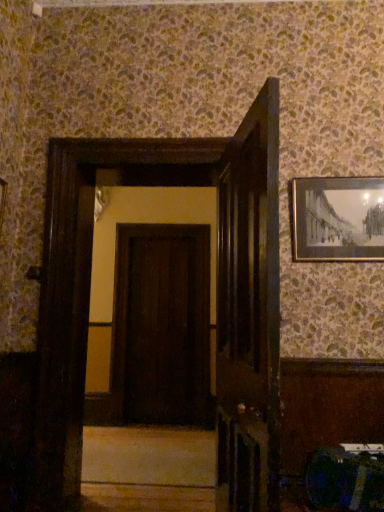
Where is `dark brown wood door at center, marked as the second door in a right-to-left arrangement`? This screenshot has width=384, height=512. dark brown wood door at center, marked as the second door in a right-to-left arrangement is located at coordinates (161, 326).

What is the approximate width of dark wood door at center, marked as the second door in a back-to-front arrangement?

dark wood door at center, marked as the second door in a back-to-front arrangement, is 22.29 centimeters in width.

Describe the element at coordinates (338, 219) in the screenshot. I see `gold-framed picture at upper right` at that location.

Image resolution: width=384 pixels, height=512 pixels. I want to click on smooth beige stair at center, so [149, 456].

Considering the relative sizes of smooth beige stair at center and dark brown wood door at center, marked as the second door in a right-to-left arrangement, in the image provided, is smooth beige stair at center wider than dark brown wood door at center, marked as the second door in a right-to-left arrangement,?

Indeed, smooth beige stair at center has a greater width compared to dark brown wood door at center, marked as the second door in a right-to-left arrangement.

Considering the relative sizes of smooth beige stair at center and dark brown wood door at center, placed as the 1th door when sorted from left to right, in the image provided, is smooth beige stair at center shorter than dark brown wood door at center, placed as the 1th door when sorted from left to right,?

Correct, smooth beige stair at center is not as tall as dark brown wood door at center, placed as the 1th door when sorted from left to right.

Could you measure the distance between smooth beige stair at center and dark brown wood door at center, positioned as the second door in front-to-back order?

smooth beige stair at center and dark brown wood door at center, positioned as the second door in front-to-back order, are 1.25 meters apart from each other.

From the picture: From a real-world perspective, is smooth beige stair at center above or below dark brown wood door at center, marked as the second door in a right-to-left arrangement?

From a real-world perspective, smooth beige stair at center is physically below dark brown wood door at center, marked as the second door in a right-to-left arrangement.

Is dark brown wood door at center, placed as the 1th door when sorted from left to right, turned away from dark wood door at center, marked as the second door in a back-to-front arrangement?

dark brown wood door at center, placed as the 1th door when sorted from left to right, is not turned away from dark wood door at center, marked as the second door in a back-to-front arrangement.

Is dark brown wood door at center, acting as the first door starting from the back, directly adjacent to dark wood door at center, arranged as the first door when viewed from the front?

They are not placed beside each other.

Considering the positions of objects dark brown wood door at center, positioned as the second door in front-to-back order, and dark wood door at center, marked as the second door in a back-to-front arrangement, in the image provided, who is more to the left, dark brown wood door at center, positioned as the second door in front-to-back order, or dark wood door at center, marked as the second door in a back-to-front arrangement,?

From the viewer's perspective, dark brown wood door at center, positioned as the second door in front-to-back order, appears more on the left side.

From the image's perspective, between dark wood door at center, which is the first door from right to left, and smooth beige stair at center, which one is located above?

From the image's view, dark wood door at center, which is the first door from right to left, is above.

Is dark wood door at center, which is the first door from right to left, smaller than smooth beige stair at center?

Incorrect, dark wood door at center, which is the first door from right to left, is not smaller in size than smooth beige stair at center.

Is dark wood door at center, which is the first door from right to left, not close to smooth beige stair at center?

Absolutely, dark wood door at center, which is the first door from right to left, is distant from smooth beige stair at center.

Which object is more forward, dark wood door at center, which is the first door from right to left, or smooth beige stair at center?

dark wood door at center, which is the first door from right to left.

This screenshot has width=384, height=512. In order to click on door that is the 1st one when counting leftward from the gold-framed picture at upper right in this screenshot , I will do `click(249, 312)`.

Which is more to the left, gold-framed picture at upper right or dark wood door at center, arranged as the first door when viewed from the front?

Positioned to the left is dark wood door at center, arranged as the first door when viewed from the front.

Based on the photo, is gold-framed picture at upper right oriented away from dark wood door at center, the second door in the left-to-right sequence?

No, dark wood door at center, the second door in the left-to-right sequence, is not at the back of gold-framed picture at upper right.

In terms of width, does gold-framed picture at upper right look wider or thinner when compared to dark wood door at center, arranged as the first door when viewed from the front?

Considering their sizes, gold-framed picture at upper right looks slimmer than dark wood door at center, arranged as the first door when viewed from the front.

Is smooth beige stair at center spatially inside dark wood door at center, which is the first door from right to left, or outside of it?

smooth beige stair at center is not enclosed by dark wood door at center, which is the first door from right to left.

Considering the relative sizes of smooth beige stair at center and dark wood door at center, the second door in the left-to-right sequence, in the image provided, is smooth beige stair at center thinner than dark wood door at center, the second door in the left-to-right sequence,?

In fact, smooth beige stair at center might be wider than dark wood door at center, the second door in the left-to-right sequence.

From the picture: From their relative heights in the image, would you say smooth beige stair at center is taller or shorter than dark wood door at center, the second door in the left-to-right sequence?

Clearly, smooth beige stair at center is shorter compared to dark wood door at center, the second door in the left-to-right sequence.

Is point (140, 465) positioned behind point (227, 358)?

Yes, point (140, 465) is behind point (227, 358).

Is gold-framed picture at upper right in front of or behind smooth beige stair at center in the image?

Visually, gold-framed picture at upper right is located in front of smooth beige stair at center.

From the image's perspective, who appears lower, gold-framed picture at upper right or smooth beige stair at center?

smooth beige stair at center appears lower in the image.

Would you say smooth beige stair at center is part of gold-framed picture at upper right's contents?

No, smooth beige stair at center is not surrounded by gold-framed picture at upper right.

Is dark brown wood door at center, positioned as the second door in front-to-back order, thinner than gold-framed picture at upper right?

In fact, dark brown wood door at center, positioned as the second door in front-to-back order, might be wider than gold-framed picture at upper right.

Can you confirm if dark brown wood door at center, placed as the 1th door when sorted from left to right, is bigger than gold-framed picture at upper right?

Correct, dark brown wood door at center, placed as the 1th door when sorted from left to right, is larger in size than gold-framed picture at upper right.

From a real-world perspective, count 1st doors downward from the gold-framed picture at upper right and point to it. Please provide its 2D coordinates.

[(161, 326)]

Based on the photo, considering the positions of objects dark brown wood door at center, acting as the first door starting from the back, and gold-framed picture at upper right in the image provided, who is in front, dark brown wood door at center, acting as the first door starting from the back, or gold-framed picture at upper right?

Positioned in front is gold-framed picture at upper right.

You are a GUI agent. You are given a task and a screenshot of the screen. Output one action in this format:
    pyautogui.click(x=<x>, y=<y>)
    Task: Click on the stair that is under the dark brown wood door at center, acting as the first door starting from the back (from a real-world perspective)
    The image size is (384, 512).
    Given the screenshot: What is the action you would take?
    pyautogui.click(x=149, y=456)

Find the location of a particular element. The image size is (384, 512). door behind the dark wood door at center, arranged as the first door when viewed from the front is located at coordinates (161, 326).

Estimate the real-world distances between objects in this image. Which object is closer to smooth beige stair at center, dark wood door at center, marked as the second door in a back-to-front arrangement, or gold-framed picture at upper right?

Based on the image, dark wood door at center, marked as the second door in a back-to-front arrangement, appears to be nearer to smooth beige stair at center.

When comparing their distances from dark brown wood door at center, placed as the 1th door when sorted from left to right, does gold-framed picture at upper right or dark wood door at center, arranged as the first door when viewed from the front, seem further?

dark wood door at center, arranged as the first door when viewed from the front, is positioned further to the anchor dark brown wood door at center, placed as the 1th door when sorted from left to right.

Considering their positions, is smooth beige stair at center positioned further to dark brown wood door at center, positioned as the second door in front-to-back order, than dark wood door at center, the second door in the left-to-right sequence?

The object further to dark brown wood door at center, positioned as the second door in front-to-back order, is dark wood door at center, the second door in the left-to-right sequence.

Based on their spatial positions, is dark brown wood door at center, placed as the 1th door when sorted from left to right, or dark wood door at center, the second door in the left-to-right sequence, closer to gold-framed picture at upper right?

Among the two, dark wood door at center, the second door in the left-to-right sequence, is located nearer to gold-framed picture at upper right.

Considering their positions, is smooth beige stair at center positioned closer to gold-framed picture at upper right than dark brown wood door at center, marked as the second door in a right-to-left arrangement?

The object closer to gold-framed picture at upper right is smooth beige stair at center.

Considering their positions, is dark brown wood door at center, placed as the 1th door when sorted from left to right, positioned closer to dark wood door at center, which is the first door from right to left, than gold-framed picture at upper right?

Result: gold-framed picture at upper right is closer to dark wood door at center, which is the first door from right to left.

Which object lies nearer to the anchor point smooth beige stair at center, dark wood door at center, which is the first door from right to left, or dark brown wood door at center, marked as the second door in a right-to-left arrangement?

dark brown wood door at center, marked as the second door in a right-to-left arrangement, lies closer to smooth beige stair at center than the other object.

Considering their positions, is dark wood door at center, the second door in the left-to-right sequence, positioned further to dark brown wood door at center, placed as the 1th door when sorted from left to right, than smooth beige stair at center?

Among the two, dark wood door at center, the second door in the left-to-right sequence, is located further to dark brown wood door at center, placed as the 1th door when sorted from left to right.

The width and height of the screenshot is (384, 512). I want to click on stair between dark wood door at center, the second door in the left-to-right sequence, and dark brown wood door at center, placed as the 1th door when sorted from left to right, along the z-axis, so [149, 456].

Identify the location of stair between gold-framed picture at upper right and dark brown wood door at center, marked as the second door in a right-to-left arrangement, from front to back. (149, 456).

At what (x,y) coordinates should I click in order to perform the action: click on picture frame located between dark wood door at center, marked as the second door in a back-to-front arrangement, and dark brown wood door at center, placed as the 1th door when sorted from left to right, in the depth direction. Please return your answer as a coordinate pair (x, y). Looking at the image, I should click on (338, 219).